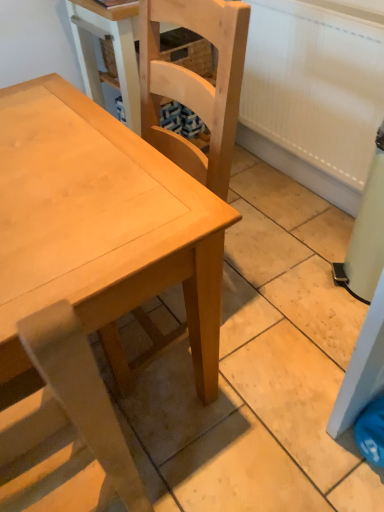
Question: Is natural wood chair at center, which appears as the second chair when ordered from the bottom, bigger or smaller than light brown wood chair at center, which is counted as the 2th chair, starting from the top?

Choices:
 (A) small
 (B) big

Answer: (B)

Question: Considering their positions, is natural wood chair at center, which appears as the second chair when ordered from the bottom, located in front of or behind light brown wood chair at center, which is the first chair in bottom-to-top order?

Choices:
 (A) behind
 (B) front

Answer: (A)

Question: Estimate the real-world distances between objects in this image. Which object is closer to the light wood table at center?

Choices:
 (A) light brown wood chair at center, which is the first chair in bottom-to-top order
 (B) natural wood chair at center, the first chair viewed from the top

Answer: (A)

Question: Based on their relative distances, which object is nearer to the light wood table at center?

Choices:
 (A) light brown wood chair at center, which is counted as the 2th chair, starting from the top
 (B) natural wood chair at center, which appears as the second chair when ordered from the bottom

Answer: (A)